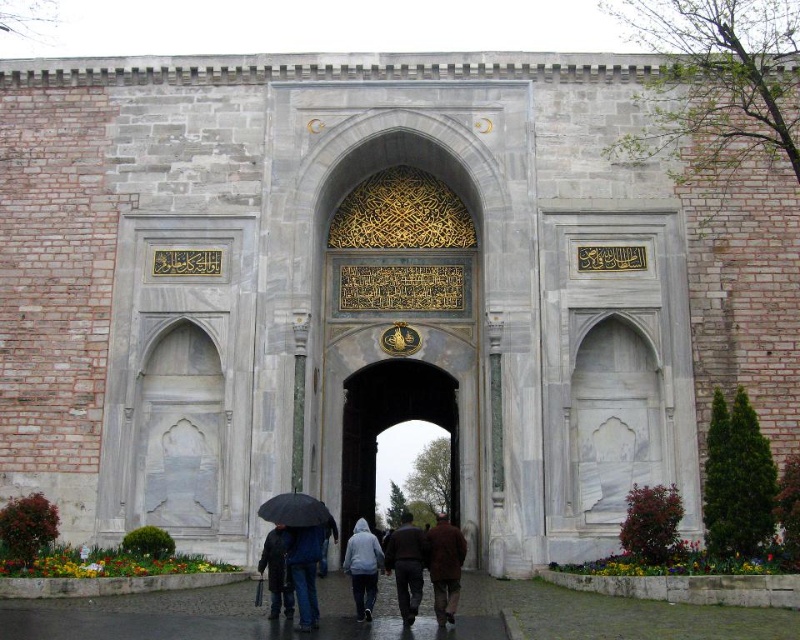
You are standing at the entrance of the building and see the gold metallic gate at center and the black matte umbrella at lower center. Which object is closer to you?

The gold metallic gate at center is closer to you because the black matte umbrella at lower center is behind it.